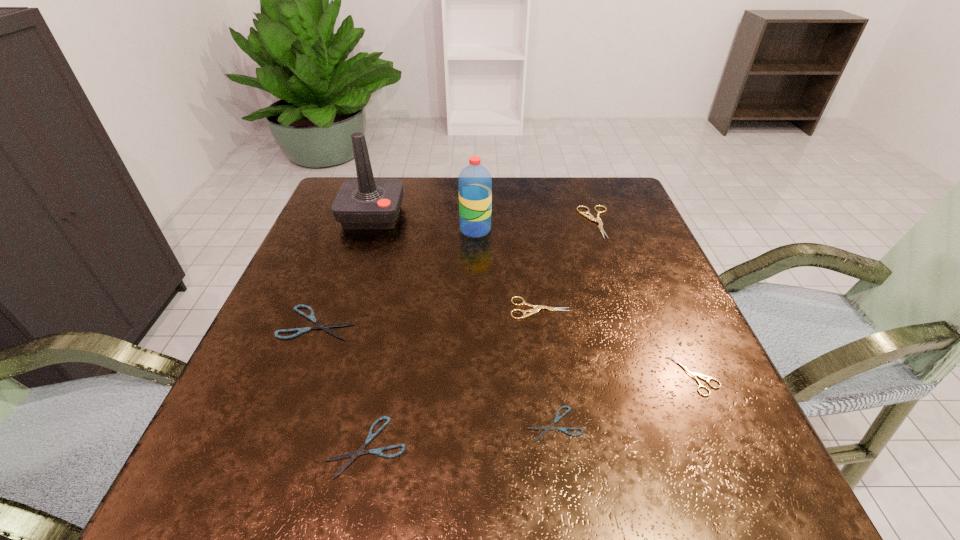
Identify the location of the rightmost object. (692, 374).

Identify the location of the fifth shears from right to left. (360, 451).

Where is `the second black shears from right to left`? The width and height of the screenshot is (960, 540). the second black shears from right to left is located at coordinates click(x=360, y=451).

The height and width of the screenshot is (540, 960). What are the coordinates of `the shortest shears` in the screenshot? It's located at (546, 428).

Where is `the smallest black shears`? The width and height of the screenshot is (960, 540). the smallest black shears is located at coordinates (546, 428).

Locate an element on the screen. The width and height of the screenshot is (960, 540). free region located 0.170m on the right of the joystick is located at coordinates (468, 215).

Locate an element on the screen. The image size is (960, 540). blank area located on the front label of the water bottle is located at coordinates (535, 230).

Identify the location of free spot located 0.210m on the left of the biggest beige shears. The width and height of the screenshot is (960, 540). (498, 222).

Find the location of `blank space located 0.070m on the back of the fifth shortest shears`. blank space located 0.070m on the back of the fifth shortest shears is located at coordinates (535, 276).

You are a GUI agent. You are given a task and a screenshot of the screen. Output one action in this format:
    pyautogui.click(x=<x>, y=<y>)
    Task: Click on the vacant space located on the back of the biggest black shears
    This screenshot has width=960, height=540.
    Given the screenshot: What is the action you would take?
    pyautogui.click(x=334, y=280)